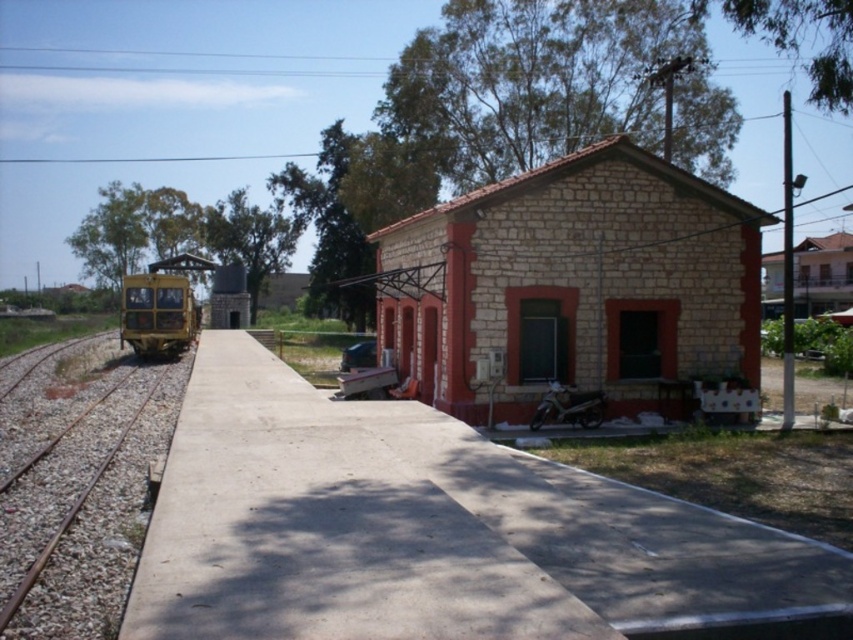
Question: Which object is the farthest from the yellow matte train at left?

Choices:
 (A) concrete platform at center
 (B) stone brick building at center

Answer: (A)

Question: Is concrete platform at center bigger than stone brick building at center?

Choices:
 (A) no
 (B) yes

Answer: (A)

Question: Is concrete platform at center to the left of yellow matte train at left from the viewer's perspective?

Choices:
 (A) no
 (B) yes

Answer: (A)

Question: Which of the following is the farthest from the observer?

Choices:
 (A) stone brick building at center
 (B) brown metal train track at left
 (C) yellow matte train at left

Answer: (C)

Question: Which of the following is the closest to the observer?

Choices:
 (A) (537, 300)
 (B) (119, 385)
 (C) (718, 524)

Answer: (C)

Question: From the image, what is the correct spatial relationship of brown metal train track at left in relation to yellow matte train at left?

Choices:
 (A) right
 (B) left

Answer: (A)